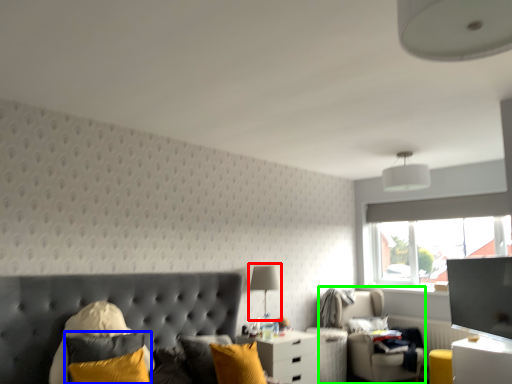
Question: Which object is the closest to the table lamp (highlighted by a red box)? Choose among these: pillow (highlighted by a blue box) or swivel chair (highlighted by a green box).

Choices:
 (A) pillow
 (B) swivel chair

Answer: (B)